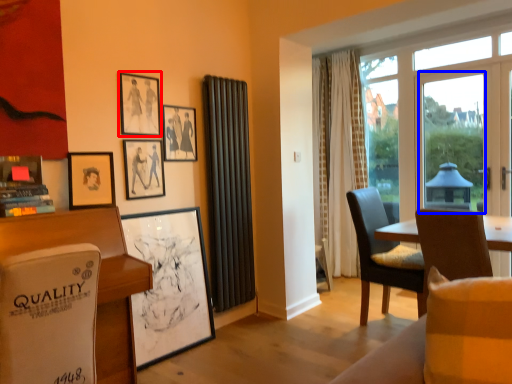
Question: Which of the following is the closest to the observer, picture frame (highlighted by a red box) or window screen (highlighted by a blue box)?

Choices:
 (A) picture frame
 (B) window screen

Answer: (A)